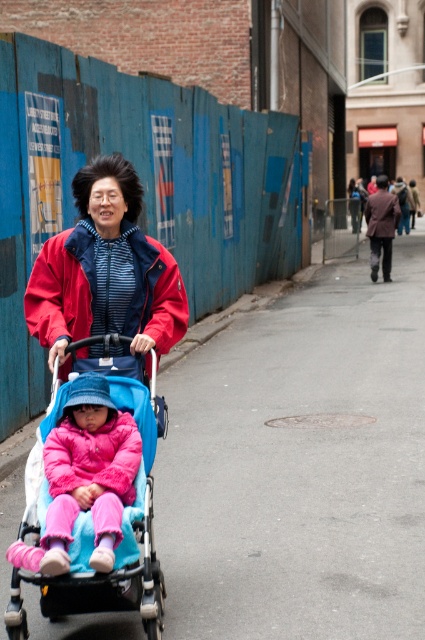
You are a delivery drone flying above an urban street scene. You need to deliver a package to the blue fabric stroller at center. According to the coordinates provided, where exactly should you drop the package?

The blue fabric stroller at center is located at point (x=122, y=552), so you should drop the package at those coordinates.

You are a delivery person trying to navigate through the alleyway. You see the blue fabric stroller at center and the matte red jacket at center. Which object is closer to the ground?

The blue fabric stroller at center is located below matte red jacket at center, so the blue fabric stroller at center is closer to the ground.

From the picture: The woman and the blue fabric stroller at center are both in the alleyway. How far apart are they?

The woman and the blue fabric stroller at center are 14.58 feet apart.